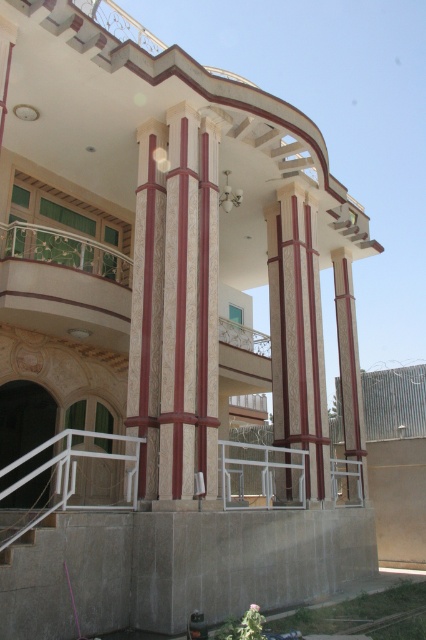
Is point (362, 456) positioned behind point (5, 547)?

Yes, point (362, 456) is farther from viewer.

Is marble column at right behind white concrete stairs at lower left?

Yes, it is.

Is point (348, 301) positioned after point (25, 536)?

That is True.

At what (x,y) coordinates should I click in order to perform the action: click on marble column at right. Please return your answer as a coordinate pair (x, y). This screenshot has width=426, height=640. Looking at the image, I should click on (348, 362).

Can you confirm if maroon textured column at center is shorter than white concrete stairs at lower left?

In fact, maroon textured column at center may be taller than white concrete stairs at lower left.

Which is below, maroon textured column at center or white concrete stairs at lower left?

white concrete stairs at lower left is lower down.

What do you see at coordinates (180, 308) in the screenshot?
I see `maroon textured column at center` at bounding box center [180, 308].

Identify the location of maroon textured column at center. The width and height of the screenshot is (426, 640). (180, 308).

I want to click on marble column at center, so click(x=146, y=307).

Can you confirm if marble column at center is wider than smooth red wood pillar at center?

Indeed, marble column at center has a greater width compared to smooth red wood pillar at center.

Between point (140, 170) and point (209, 497), which one is positioned in front?

Point (209, 497) is more forward.

Locate an element on the screen. Image resolution: width=426 pixels, height=640 pixels. marble column at center is located at coordinates (146, 307).